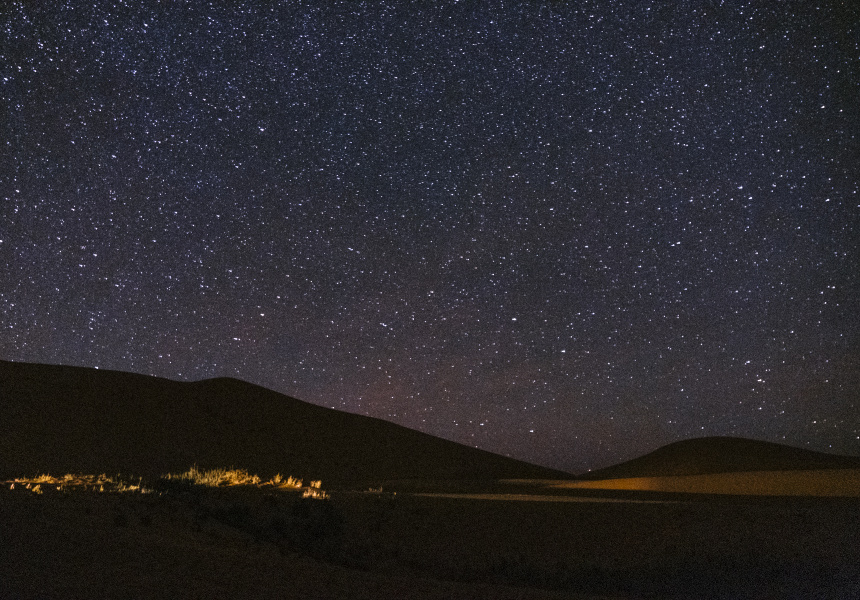
Image resolution: width=860 pixels, height=600 pixels. I want to click on yellow light on ground, so click(x=641, y=482).